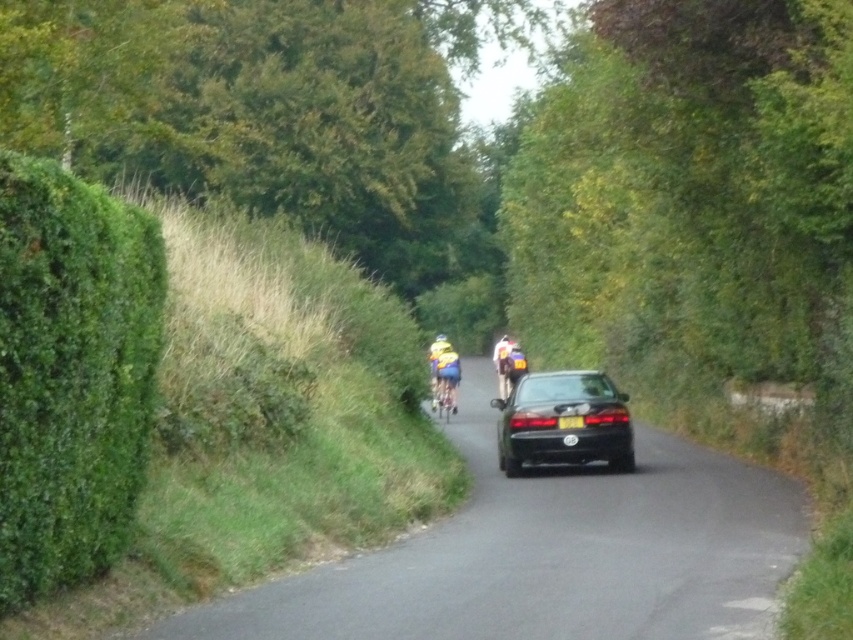
Is green leafy hedge at left below yellow fabric helmet at center?

Incorrect, green leafy hedge at left is not positioned below yellow fabric helmet at center.

Between point (91, 228) and point (440, 332), which one is positioned behind?

Point (440, 332)

In order to click on green leafy hedge at left in this screenshot , I will do `click(71, 372)`.

Can you confirm if black asphalt road at center is positioned to the left of yellow matte helmet at center?

Incorrect, black asphalt road at center is not on the left side of yellow matte helmet at center.

Which of these two, black asphalt road at center or yellow matte helmet at center, stands taller?

With more height is black asphalt road at center.

Describe the element at coordinates (549, 554) in the screenshot. I see `black asphalt road at center` at that location.

This screenshot has width=853, height=640. Identify the location of black asphalt road at center. (549, 554).

Is yellow fabric bicycle at center below yellow fabric helmet at center?

Indeed, yellow fabric bicycle at center is positioned under yellow fabric helmet at center.

Is yellow fabric bicycle at center further to camera compared to yellow fabric helmet at center?

No, it is not.

Is point (444, 404) in front of point (442, 340)?

Yes, it is in front of point (442, 340).

Identify the location of yellow fabric bicycle at center. The width and height of the screenshot is (853, 640). (444, 397).